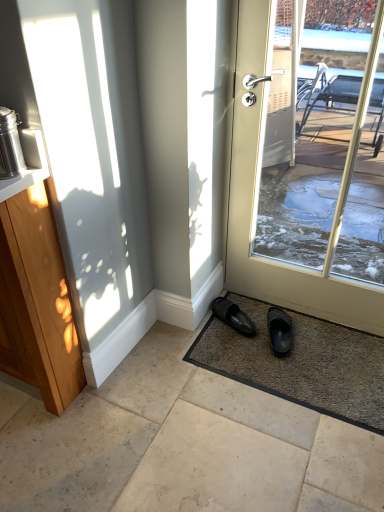
Where is `vacant space in front of black rubber slipper at lower right, which is the 1th footwear in right-to-left order`? The width and height of the screenshot is (384, 512). vacant space in front of black rubber slipper at lower right, which is the 1th footwear in right-to-left order is located at coordinates (289, 372).